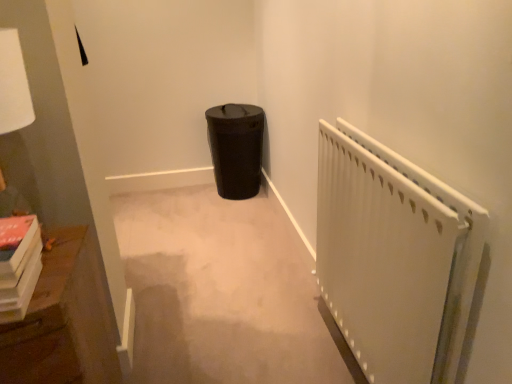
Measure the distance between point [13,370] and camera.

Point [13,370] and camera are 35.12 inches apart.

Locate an element on the screen. Image resolution: width=512 pixels, height=384 pixels. black matte trash can at center is located at coordinates (236, 148).

Can you see wooden bookshelf at left touching white matte radiator at right?

No.

From the image's perspective, is wooden bookshelf at left positioned above or below white matte radiator at right?

From the image's perspective, wooden bookshelf at left appears below white matte radiator at right.

Which point is more forward, (84, 382) or (452, 240)?

The point (452, 240) is in front.

Between wooden bookshelf at left and white matte radiator at right, which one appears on the left side from the viewer's perspective?

From the viewer's perspective, wooden bookshelf at left appears more on the left side.

From the image's perspective, between white matte radiator at right and black matte trash can at center, who is located below?

white matte radiator at right, from the image's perspective.

Between white matte radiator at right and black matte trash can at center, which one is positioned in front?

white matte radiator at right is more forward.

Is there a large distance between white matte radiator at right and black matte trash can at center?

white matte radiator at right is far away from black matte trash can at center.

Find the location of a particular element. furniture behind the white matte radiator at right is located at coordinates (63, 321).

Measure the distance between white matte radiator at right and wooden bookshelf at left.

A distance of 80.03 centimeters exists between white matte radiator at right and wooden bookshelf at left.

What's the angular difference between white matte radiator at right and wooden bookshelf at left's facing directions?

There is a 86.5-degree angle between the facing directions of white matte radiator at right and wooden bookshelf at left.

Is wooden bookshelf at left located within white matte radiator at right?

That's incorrect, wooden bookshelf at left is not inside white matte radiator at right.

In order to click on garbage lying behind the wooden bookshelf at left in this screenshot , I will do `click(236, 148)`.

Considering the positions of objects black matte trash can at center and wooden bookshelf at left in the image provided, who is in front, black matte trash can at center or wooden bookshelf at left?

wooden bookshelf at left is closer to the camera.

Is black matte trash can at center to the left of wooden bookshelf at left from the viewer's perspective?

Incorrect, black matte trash can at center is not on the left side of wooden bookshelf at left.

From a real-world perspective, is black matte trash can at center beneath wooden bookshelf at left?

Indeed, from a real-world perspective, black matte trash can at center is positioned beneath wooden bookshelf at left.

In the scene shown: From a real-world perspective, who is located higher, wooden bookshelf at left or black matte trash can at center?

wooden bookshelf at left is physically above.

Can you confirm if wooden bookshelf at left is smaller than black matte trash can at center?

Incorrect, wooden bookshelf at left is not smaller in size than black matte trash can at center.

Does wooden bookshelf at left turn towards black matte trash can at center?

No, wooden bookshelf at left is not turned towards black matte trash can at center.

Where is `radiator below the black matte trash can at center (from the image's perspective)`? radiator below the black matte trash can at center (from the image's perspective) is located at coordinates point(395,258).

Which is closer to the camera, (215, 133) or (436, 184)?

Point (215, 133) is farther from the camera than point (436, 184).

Are black matte trash can at center and white matte radiator at right beside each other?

No, black matte trash can at center is not in contact with white matte radiator at right.

Where is `furniture that is under the white matte radiator at right (from a real-world perspective)`? The image size is (512, 384). furniture that is under the white matte radiator at right (from a real-world perspective) is located at coordinates (63, 321).

Where is `garbage that appears on the left of white matte radiator at right`? Image resolution: width=512 pixels, height=384 pixels. garbage that appears on the left of white matte radiator at right is located at coordinates (236, 148).

When comparing their distances from wooden bookshelf at left, does black matte trash can at center or white matte radiator at right seem closer?

Among the two, white matte radiator at right is located nearer to wooden bookshelf at left.

When comparing their distances from white matte radiator at right, does black matte trash can at center or wooden bookshelf at left seem closer?

Based on the image, wooden bookshelf at left appears to be nearer to white matte radiator at right.

When comparing their distances from black matte trash can at center, does wooden bookshelf at left or white matte radiator at right seem further?

The object further to black matte trash can at center is wooden bookshelf at left.

Considering their positions, is white matte radiator at right positioned further to black matte trash can at center than wooden bookshelf at left?

Among the two, wooden bookshelf at left is located further to black matte trash can at center.

Looking at the image, which one is located closer to wooden bookshelf at left, white matte radiator at right or black matte trash can at center?

white matte radiator at right.

Looking at this image, which object lies nearer to the anchor point white matte radiator at right, wooden bookshelf at left or black matte trash can at center?

The object closer to white matte radiator at right is wooden bookshelf at left.

I want to click on furniture between white matte radiator at right and black matte trash can at center along the z-axis, so click(x=63, y=321).